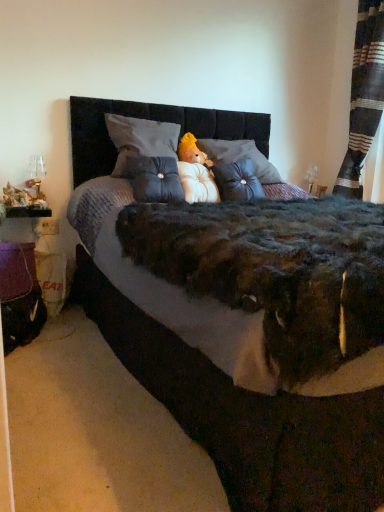
The image size is (384, 512). Find the location of `velvet black bed at center`. velvet black bed at center is located at coordinates (248, 418).

The image size is (384, 512). What do you see at coordinates (192, 151) in the screenshot?
I see `fluffy white teddy bear at center` at bounding box center [192, 151].

Describe the element at coordinates (154, 179) in the screenshot. I see `tufted fabric pillow at center, the second throw pillow viewed from the right` at that location.

Locate an element on the screen. The width and height of the screenshot is (384, 512). velvet black bed at center is located at coordinates (248, 418).

Considering the sizes of objects fluffy white teddy bear at center and striped fabric curtain at right in the image provided, who is wider, fluffy white teddy bear at center or striped fabric curtain at right?

Wider between the two is striped fabric curtain at right.

Who is more distant, fluffy white teddy bear at center or striped fabric curtain at right?

Positioned behind is fluffy white teddy bear at center.

How many degrees apart are the facing directions of fluffy white teddy bear at center and striped fabric curtain at right?

They differ by 81.5 degrees in their facing directions.

Can you confirm if fluffy white teddy bear at center is positioned to the right of striped fabric curtain at right?

In fact, fluffy white teddy bear at center is to the left of striped fabric curtain at right.

Is tufted fabric pillow at center, which appears as the first throw pillow when viewed from the left, with velvet gray throw pillow at center, the first throw pillow from the right?

There is a gap between tufted fabric pillow at center, which appears as the first throw pillow when viewed from the left, and velvet gray throw pillow at center, the first throw pillow from the right.

Is tufted fabric pillow at center, the second throw pillow viewed from the right, at the left side of velvet gray throw pillow at center, the 2th throw pillow viewed from the left?

Correct, you'll find tufted fabric pillow at center, the second throw pillow viewed from the right, to the left of velvet gray throw pillow at center, the 2th throw pillow viewed from the left.

From a real-world perspective, is tufted fabric pillow at center, the second throw pillow viewed from the right, below velvet gray throw pillow at center, the 2th throw pillow viewed from the left?

Incorrect, from a real-world perspective, tufted fabric pillow at center, the second throw pillow viewed from the right, is higher than velvet gray throw pillow at center, the 2th throw pillow viewed from the left.

Is white plush bear at center spatially inside velvet gray throw pillow at center, the 2th throw pillow viewed from the left, or outside of it?

white plush bear at center exists outside the volume of velvet gray throw pillow at center, the 2th throw pillow viewed from the left.

Is white plush bear at center not near velvet gray throw pillow at center, the first throw pillow from the right?

They are positioned close to each other.

Which object is closer to the camera taking this photo, white plush bear at center or velvet gray throw pillow at center, the 2th throw pillow viewed from the left?

white plush bear at center.

Can you tell me how much white plush bear at center and velvet gray throw pillow at center, the first throw pillow from the right, differ in facing direction?

The angle between the facing direction of white plush bear at center and the facing direction of velvet gray throw pillow at center, the first throw pillow from the right, is 20.6 degrees.

Is fluffy white teddy bear at center in front of or behind white plush bear at center in the image?

fluffy white teddy bear at center is positioned farther from the viewer than white plush bear at center.

Is fluffy white teddy bear at center surrounding white plush bear at center?

No, white plush bear at center is not surrounded by fluffy white teddy bear at center.

Is fluffy white teddy bear at center oriented towards white plush bear at center?

No, fluffy white teddy bear at center is not turned towards white plush bear at center.

Where is `animal that appears above the white plush bear at center (from a real-world perspective)`? The height and width of the screenshot is (512, 384). animal that appears above the white plush bear at center (from a real-world perspective) is located at coordinates (192, 151).

Which is behind, tufted fabric pillow at center, which appears as the first throw pillow when viewed from the left, or white soft pillow at center?

white soft pillow at center is more distant.

Looking at the image, does tufted fabric pillow at center, the second throw pillow viewed from the right, seem bigger or smaller compared to white soft pillow at center?

Clearly, tufted fabric pillow at center, the second throw pillow viewed from the right, is smaller in size than white soft pillow at center.

How many degrees apart are the facing directions of tufted fabric pillow at center, the second throw pillow viewed from the right, and white soft pillow at center?

The angle between the facing direction of tufted fabric pillow at center, the second throw pillow viewed from the right, and the facing direction of white soft pillow at center is 2.7 degrees.

Is there a large distance between tufted fabric pillow at center, which appears as the first throw pillow when viewed from the left, and white soft pillow at center?

Actually, tufted fabric pillow at center, which appears as the first throw pillow when viewed from the left, and white soft pillow at center are a little close together.

Is striped fabric curtain at right facing away from velvet gray throw pillow at center, the 2th throw pillow viewed from the left?

No, striped fabric curtain at right is not facing the opposite direction of velvet gray throw pillow at center, the 2th throw pillow viewed from the left.

Is point (367, 106) in front of point (249, 164)?

No, (367, 106) is further to viewer.

In terms of height, does striped fabric curtain at right look taller or shorter compared to velvet gray throw pillow at center, the 2th throw pillow viewed from the left?

Considering their sizes, striped fabric curtain at right has more height than velvet gray throw pillow at center, the 2th throw pillow viewed from the left.

Which object is further away from the camera taking this photo, striped fabric curtain at right or velvet gray throw pillow at center, the 2th throw pillow viewed from the left?

striped fabric curtain at right is more distant.

Considering the sizes of objects fluffy white teddy bear at center and white soft pillow at center in the image provided, who is wider, fluffy white teddy bear at center or white soft pillow at center?

With larger width is white soft pillow at center.

Is point (202, 159) positioned behind point (109, 128)?

Yes, point (202, 159) is farther from viewer.

Locate an element on the screen. This screenshot has width=384, height=512. curtain located above the fluffy white teddy bear at center (from a real-world perspective) is located at coordinates (363, 95).

Where is `throw pillow below the velvet gray throw pillow at center, the first throw pillow from the right (from the image's perspective)`? throw pillow below the velvet gray throw pillow at center, the first throw pillow from the right (from the image's perspective) is located at coordinates (154, 179).

Based on their spatial positions, is purple fabric table at lower left or white plush bear at center further from white soft pillow at center?

The object further to white soft pillow at center is purple fabric table at lower left.

Which object lies nearer to the anchor point striped fabric curtain at right, white plush bear at center or tufted fabric pillow at center, which appears as the first throw pillow when viewed from the left?

The object closer to striped fabric curtain at right is white plush bear at center.

Considering their positions, is velvet gray throw pillow at center, the 2th throw pillow viewed from the left, positioned further to white soft pillow at center than tufted fabric pillow at center, the second throw pillow viewed from the right?

velvet gray throw pillow at center, the 2th throw pillow viewed from the left, is further to white soft pillow at center.

Considering their positions, is purple fabric table at lower left positioned closer to white plush bear at center than tufted fabric pillow at center, which appears as the first throw pillow when viewed from the left?

The object closer to white plush bear at center is tufted fabric pillow at center, which appears as the first throw pillow when viewed from the left.

Based on their spatial positions, is white plush bear at center or white soft pillow at center closer to striped fabric curtain at right?

white plush bear at center is closer to striped fabric curtain at right.

Estimate the real-world distances between objects in this image. Which object is further from fluffy white teddy bear at center, velvet gray throw pillow at center, the 2th throw pillow viewed from the left, or white soft pillow at center?

white soft pillow at center is further to fluffy white teddy bear at center.

From the image, which object appears to be farther from white soft pillow at center, purple fabric table at lower left or tufted fabric pillow at center, the second throw pillow viewed from the right?

purple fabric table at lower left.

Based on their spatial positions, is velvet gray throw pillow at center, the first throw pillow from the right, or white soft pillow at center further from striped fabric curtain at right?

The object further to striped fabric curtain at right is white soft pillow at center.

Where is `pillow positioned between tufted fabric pillow at center, the second throw pillow viewed from the right, and fluffy white teddy bear at center from near to far`? Image resolution: width=384 pixels, height=512 pixels. pillow positioned between tufted fabric pillow at center, the second throw pillow viewed from the right, and fluffy white teddy bear at center from near to far is located at coordinates (141, 139).

Identify the location of throw pillow between purple fabric table at lower left and fluffy white teddy bear at center in the horizontal direction. Image resolution: width=384 pixels, height=512 pixels. (154, 179).

Where is `pillow located between velvet black bed at center and white plush bear at center in the depth direction`? The width and height of the screenshot is (384, 512). pillow located between velvet black bed at center and white plush bear at center in the depth direction is located at coordinates (141, 139).

I want to click on toy between white soft pillow at center and fluffy white teddy bear at center, so click(195, 172).